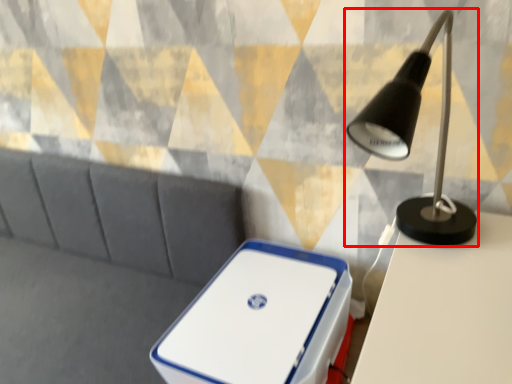
Question: From the image's perspective, where is lamp (annotated by the red box) located in relation to storage box in the image?

Choices:
 (A) below
 (B) above

Answer: (B)